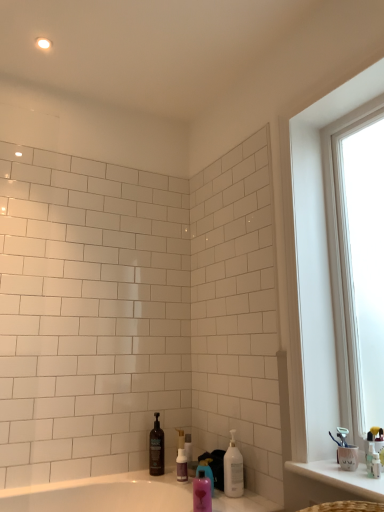
Question: Considering the positions of pink glossy mouthwash at lower center and white plastic toothbrush at right, arranged as the third toiletry when viewed from the left, in the image, is pink glossy mouthwash at lower center bigger or smaller than white plastic toothbrush at right, arranged as the third toiletry when viewed from the left,?

Choices:
 (A) big
 (B) small

Answer: (A)

Question: Is pink glossy mouthwash at lower center taller or shorter than white plastic toothbrush at right, the 1th toiletry in the top-to-bottom sequence?

Choices:
 (A) short
 (B) tall

Answer: (B)

Question: Which is nearer to the pink glossy bottle at lower center, placed as the 2th cleaning product when sorted from back to front?

Choices:
 (A) clear plastic bottle at center, arranged as the second toiletry when viewed from the right
 (B) white glossy pump bottle at lower center, which is the first cleaning product in right-to-left order
 (C) transparent glass window at right
 (D) translucent purple bottle at lower center, the 2th toiletry ordered from the bottom
 (E) dark brown plastic bottle at center, the third cleaning product when ordered from right to left

Answer: (B)

Question: Which of these objects is positioned closest to the white plastic toothbrush at right, which is the first toiletry in right-to-left order?

Choices:
 (A) clear plastic bottle at center, which ranks as the second toiletry in left-to-right order
 (B) white glossy pump bottle at lower center, placed as the third cleaning product when sorted from left to right
 (C) pink glossy mouthwash at lower center
 (D) pink glossy bottle at lower center, acting as the second cleaning product starting from the front
 (E) transparent glass window at right

Answer: (B)